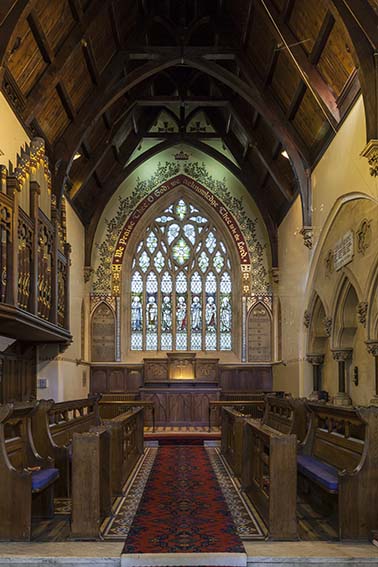
The height and width of the screenshot is (567, 378). In order to click on red carpet in this screenshot , I will do `click(213, 532)`.